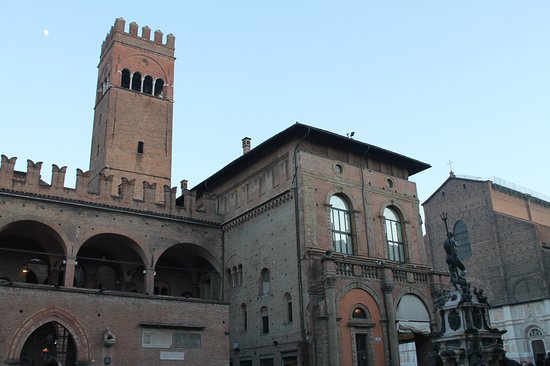
Identify the location of window gates. (342, 231), (390, 238).